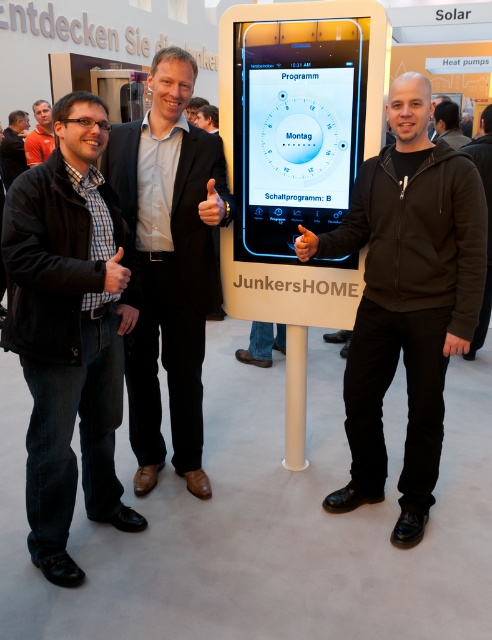
Can you confirm if black matte jacket at left is taller than orange shirt at upper left?

Indeed, black matte jacket at left has a greater height compared to orange shirt at upper left.

I want to click on black matte jacket at left, so click(69, 330).

At what (x,y) coordinates should I click in order to perform the action: click on black matte jacket at left. Please return your answer as a coordinate pair (x, y). Looking at the image, I should click on (69, 330).

Looking at this image, who is lower down, black matte jacket at center or orange shirt at upper left?

black matte jacket at center

At what (x,y) coordinates should I click in order to perform the action: click on black matte jacket at center. Please return your answer as a coordinate pair (x, y). Looking at the image, I should click on (406, 300).

Between matte black jacket at left and orange shirt at upper left, which one appears on the left side from the viewer's perspective?

Positioned to the left is matte black jacket at left.

Can you confirm if matte black jacket at left is positioned above orange shirt at upper left?

Actually, matte black jacket at left is below orange shirt at upper left.

The width and height of the screenshot is (492, 640). What are the coordinates of `matte black jacket at left` in the screenshot? It's located at (13, 147).